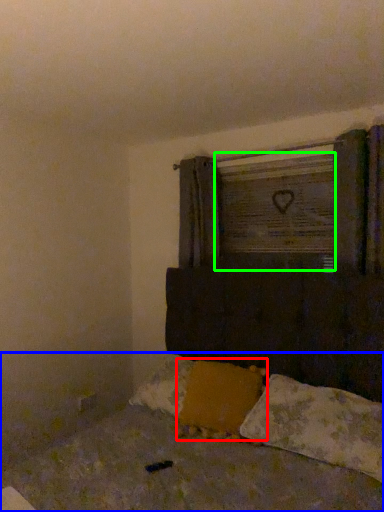
Question: Based on their relative distances, which object is farther from pillow (highlighted by a red box)? Choose from bed (highlighted by a blue box) and window frame (highlighted by a green box).

Choices:
 (A) bed
 (B) window frame

Answer: (B)